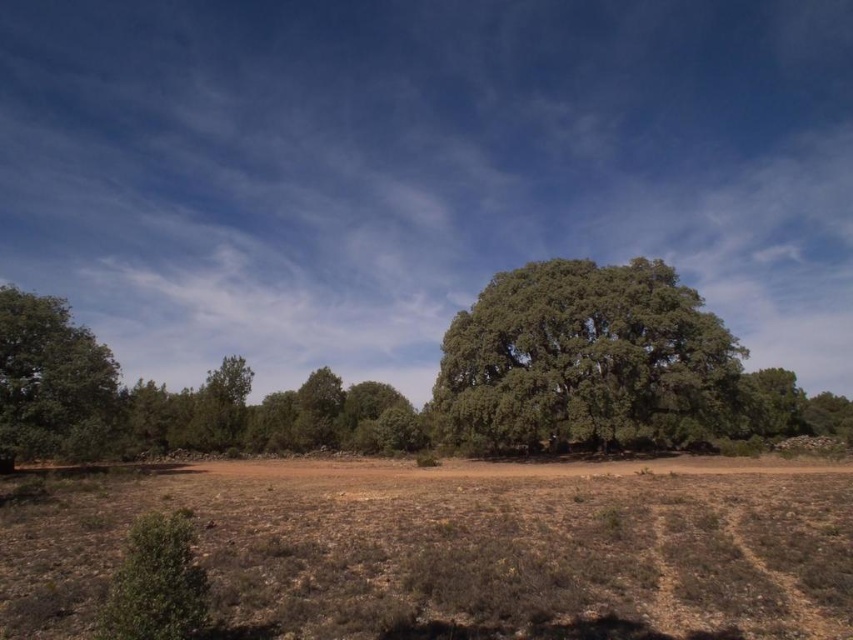
Question: Which point appears closest to the camera in this image?

Choices:
 (A) (672, 346)
 (B) (492, 465)
 (C) (35, 426)

Answer: (C)

Question: Does brown dry grass at lower center appear over green leafy tree at left?

Choices:
 (A) no
 (B) yes

Answer: (A)

Question: Is brown dry grass at lower center behind green leafy tree at left?

Choices:
 (A) no
 (B) yes

Answer: (A)

Question: Does brown dry grass at lower center have a larger size compared to green leafy tree at center?

Choices:
 (A) yes
 (B) no

Answer: (B)

Question: Which point appears farthest from the camera in this image?

Choices:
 (A) (469, 522)
 (B) (68, 342)

Answer: (B)

Question: Which object is farther from the camera taking this photo?

Choices:
 (A) green leafy tree at center
 (B) green leafy tree at left
 (C) brown dry grass at lower center

Answer: (A)